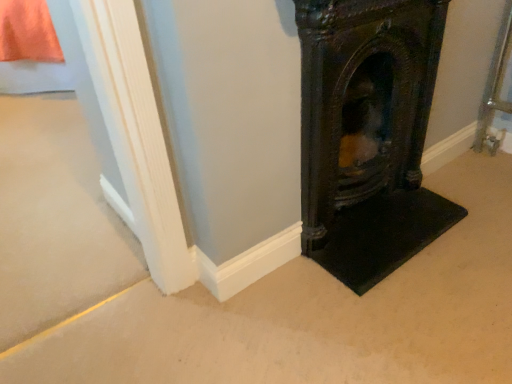
Locate an element on the screen. The width and height of the screenshot is (512, 384). dark brown cast iron fireplace at center is located at coordinates (368, 134).

The height and width of the screenshot is (384, 512). What do you see at coordinates (368, 134) in the screenshot? I see `dark brown cast iron fireplace at center` at bounding box center [368, 134].

Where is `dark brown cast iron fireplace at center`? dark brown cast iron fireplace at center is located at coordinates (368, 134).